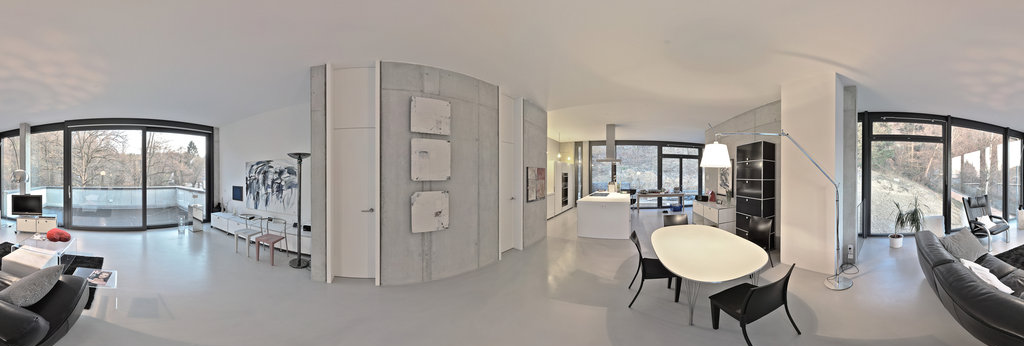
Where is `sofa`? sofa is located at coordinates (982, 204).